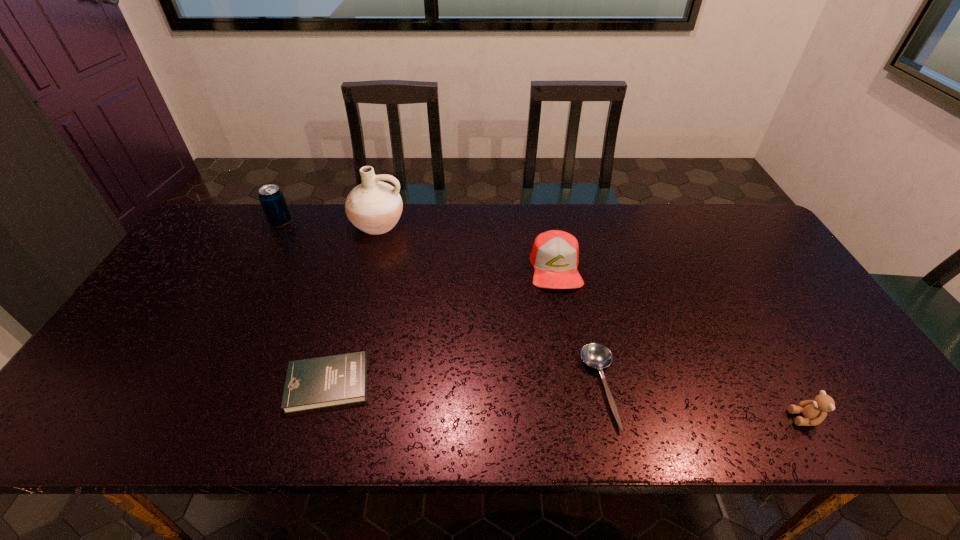
Image resolution: width=960 pixels, height=540 pixels. Find the location of `book situated at the near edge`. book situated at the near edge is located at coordinates (329, 381).

Identify the location of ladle that is at the near edge. This screenshot has width=960, height=540. (595, 355).

At what (x,y) coordinates should I click in order to perform the action: click on vacant space at the far edge of the desktop. Please return your answer as a coordinate pair (x, y). This screenshot has height=540, width=960. Looking at the image, I should click on (303, 217).

Identify the location of free space at the near edge of the desktop. [x=788, y=408].

I want to click on vacant point at the left edge, so click(x=139, y=395).

Image resolution: width=960 pixels, height=540 pixels. Identify the location of free spot at the right edge of the desktop. (778, 286).

Where is `blank area at the far right corner`? blank area at the far right corner is located at coordinates (706, 207).

Locate an element on the screen. Image resolution: width=960 pixels, height=540 pixels. free space between the baseball cap and the teddy bear is located at coordinates point(680,343).

At what (x,y) coordinates should I click in order to perform the action: click on vacant point located between the fifth shortest object and the ladle. Please return your answer as a coordinate pair (x, y). Looking at the image, I should click on (441, 305).

The height and width of the screenshot is (540, 960). What are the coordinates of `vacant point located between the leftmost object and the teddy bear` in the screenshot? It's located at (542, 320).